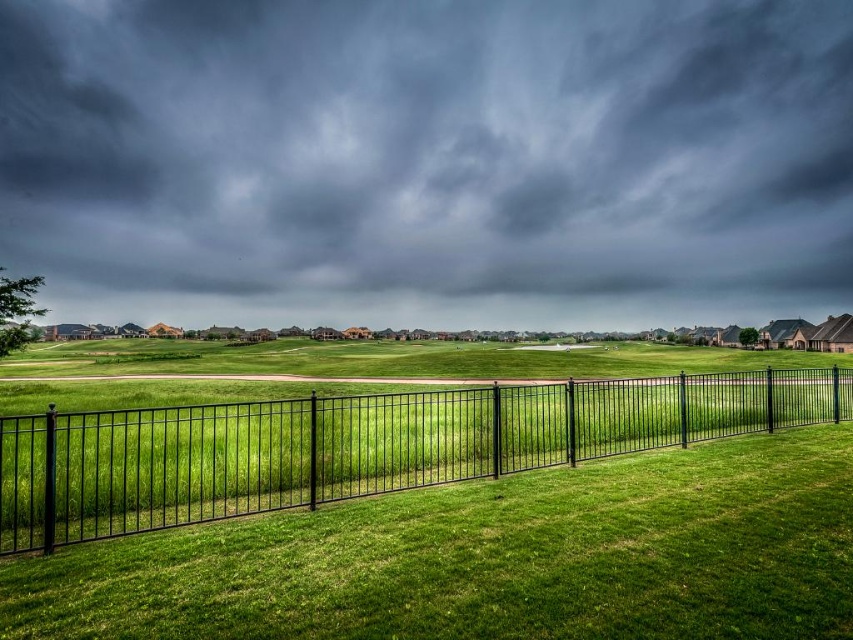
Between dark gray cloud at upper center and black metal fence at center, which one is positioned higher?

dark gray cloud at upper center

The width and height of the screenshot is (853, 640). I want to click on dark gray cloud at upper center, so click(428, 160).

Does point (434, 1) come farther from viewer compared to point (782, 416)?

Yes, point (434, 1) is behind point (782, 416).

Find the location of a particular element. The height and width of the screenshot is (640, 853). dark gray cloud at upper center is located at coordinates (428, 160).